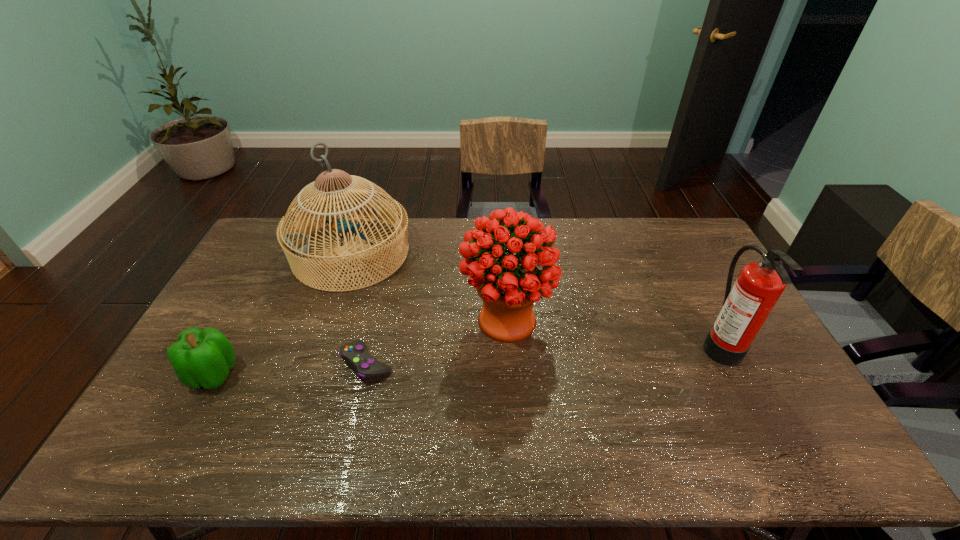
Identify the location of object that is the second closest one to the birdcage. The width and height of the screenshot is (960, 540). (354, 354).

The width and height of the screenshot is (960, 540). In order to click on the fourth closest object to the rightmost object in this screenshot , I will do `click(200, 358)`.

Identify the location of vacant space that satisfies the following two spatial constraints: 1. on the back side of the bouquet; 2. on the right side of the control. (377, 320).